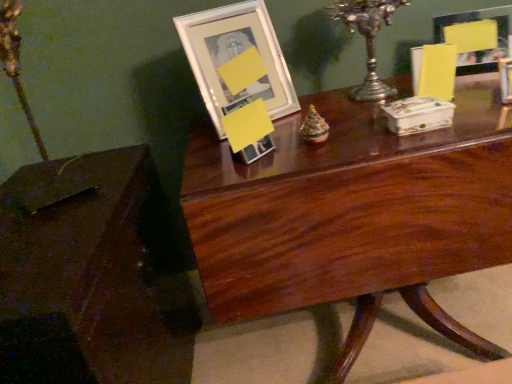
Describe the element at coordinates (92, 275) in the screenshot. I see `brown polished wood table at lower left, the 2th table viewed from the right` at that location.

The image size is (512, 384). Describe the element at coordinates (367, 39) in the screenshot. I see `silver metallic candle holder at upper center` at that location.

Where is `white glossy picture frame at upper center, placed as the 2th picture frame when sorted from right to left`? white glossy picture frame at upper center, placed as the 2th picture frame when sorted from right to left is located at coordinates (236, 56).

What do you see at coordinates (477, 50) in the screenshot?
I see `matte glass picture frame at upper right, acting as the 1th picture frame starting from the right` at bounding box center [477, 50].

How much space does matte glass picture frame at upper right, acting as the 1th picture frame starting from the right, occupy horizontally?

The width of matte glass picture frame at upper right, acting as the 1th picture frame starting from the right, is 4.42 inches.

This screenshot has width=512, height=384. Find the location of `brown polished wood table at lower left, the 1th table viewed from the left`. brown polished wood table at lower left, the 1th table viewed from the left is located at coordinates (92, 275).

From the image's perspective, relative to white glossy picture frame at upper center, the 1th picture frame positioned from the left, is matte glass picture frame at upper right, acting as the 1th picture frame starting from the right, above or below?

From the image's perspective, matte glass picture frame at upper right, acting as the 1th picture frame starting from the right, appears above white glossy picture frame at upper center, the 1th picture frame positioned from the left.

Consider the image. Is matte glass picture frame at upper right, acting as the 1th picture frame starting from the right, taller or shorter than white glossy picture frame at upper center, placed as the 2th picture frame when sorted from right to left?

Considering their sizes, matte glass picture frame at upper right, acting as the 1th picture frame starting from the right, has less height than white glossy picture frame at upper center, placed as the 2th picture frame when sorted from right to left.

From a real-world perspective, between matte glass picture frame at upper right, acting as the 1th picture frame starting from the right, and white glossy picture frame at upper center, the 1th picture frame positioned from the left, who is vertically lower?

matte glass picture frame at upper right, acting as the 1th picture frame starting from the right.

Which point is more distant from viewer, (193, 46) or (356, 267)?

The point (193, 46) is farther from the camera.

At what (x,y) coordinates should I click in order to perform the action: click on picture frame that is the 1st one when counting upward from the mahogany wood table at center, which is the second table in left-to-right order (from the image's perspective). Please return your answer as a coordinate pair (x, y). This screenshot has width=512, height=384. Looking at the image, I should click on (236, 56).

Is white glossy picture frame at upper center, placed as the 2th picture frame when sorted from right to left, looking in the opposite direction of mahogany wood table at center, acting as the first table starting from the right?

That's not correct — white glossy picture frame at upper center, placed as the 2th picture frame when sorted from right to left, is not looking away from mahogany wood table at center, acting as the first table starting from the right.

Can you confirm if silver metallic candle holder at upper center is smaller than white glossy picture frame at upper center, the 1th picture frame positioned from the left?

Yes.

Would you say silver metallic candle holder at upper center is a long distance from white glossy picture frame at upper center, the 1th picture frame positioned from the left?

silver metallic candle holder at upper center is near white glossy picture frame at upper center, the 1th picture frame positioned from the left, not far away.

Looking at this image, does silver metallic candle holder at upper center have a lesser height compared to white glossy picture frame at upper center, the 1th picture frame positioned from the left?

Yes.

Is there a large distance between silver metallic candle holder at upper center and matte glass picture frame at upper right, acting as the 1th picture frame starting from the right?

Actually, silver metallic candle holder at upper center and matte glass picture frame at upper right, acting as the 1th picture frame starting from the right, are a little close together.

From the picture: Is silver metallic candle holder at upper center positioned behind matte glass picture frame at upper right, acting as the 1th picture frame starting from the right?

No.

How different are the orientations of silver metallic candle holder at upper center and matte glass picture frame at upper right, acting as the 1th picture frame starting from the right, in degrees?

There is a 18.7-degree angle between the facing directions of silver metallic candle holder at upper center and matte glass picture frame at upper right, acting as the 1th picture frame starting from the right.

Which is closer to the camera, (372, 30) or (474, 65)?

Point (372, 30)

Based on the photo, from the image's perspective, is white glossy picture frame at upper center, the 1th picture frame positioned from the left, positioned above or below matte glass picture frame at upper right, which is counted as the 2th picture frame, starting from the left?

Clearly, from the image's perspective, white glossy picture frame at upper center, the 1th picture frame positioned from the left, is below matte glass picture frame at upper right, which is counted as the 2th picture frame, starting from the left.

From the picture: Does white glossy picture frame at upper center, placed as the 2th picture frame when sorted from right to left, appear on the right side of matte glass picture frame at upper right, acting as the 1th picture frame starting from the right?

Incorrect, white glossy picture frame at upper center, placed as the 2th picture frame when sorted from right to left, is not on the right side of matte glass picture frame at upper right, acting as the 1th picture frame starting from the right.

Is white glossy picture frame at upper center, placed as the 2th picture frame when sorted from right to left, far away from matte glass picture frame at upper right, which is counted as the 2th picture frame, starting from the left?

white glossy picture frame at upper center, placed as the 2th picture frame when sorted from right to left, is actually quite close to matte glass picture frame at upper right, which is counted as the 2th picture frame, starting from the left.

Considering the relative sizes of white glossy picture frame at upper center, placed as the 2th picture frame when sorted from right to left, and matte glass picture frame at upper right, acting as the 1th picture frame starting from the right, in the image provided, is white glossy picture frame at upper center, placed as the 2th picture frame when sorted from right to left, bigger than matte glass picture frame at upper right, acting as the 1th picture frame starting from the right,?

Correct, white glossy picture frame at upper center, placed as the 2th picture frame when sorted from right to left, is larger in size than matte glass picture frame at upper right, acting as the 1th picture frame starting from the right.

Considering the positions of objects brown polished wood table at lower left, the 2th table viewed from the right, and silver metallic candle holder at upper center in the image provided, who is more to the left, brown polished wood table at lower left, the 2th table viewed from the right, or silver metallic candle holder at upper center?

brown polished wood table at lower left, the 2th table viewed from the right.

Is brown polished wood table at lower left, the 2th table viewed from the right, facing away from silver metallic candle holder at upper center?

No, silver metallic candle holder at upper center is not at the back of brown polished wood table at lower left, the 2th table viewed from the right.

Considering the relative positions of brown polished wood table at lower left, the 1th table viewed from the left, and silver metallic candle holder at upper center in the image provided, is brown polished wood table at lower left, the 1th table viewed from the left, behind silver metallic candle holder at upper center?

No, it is not.

The image size is (512, 384). In order to click on candle holder above the brown polished wood table at lower left, the 2th table viewed from the right (from a real-world perspective) in this screenshot , I will do `click(367, 39)`.

Is mahogany wood table at center, which is the second table in left-to-right order, spatially inside brown polished wood table at lower left, the 1th table viewed from the left, or outside of it?

The correct answer is: outside.

Is the position of mahogany wood table at center, acting as the first table starting from the right, less distant than that of brown polished wood table at lower left, the 1th table viewed from the left?

No, the depth of mahogany wood table at center, acting as the first table starting from the right, is greater than that of brown polished wood table at lower left, the 1th table viewed from the left.

The height and width of the screenshot is (384, 512). I want to click on table located underneath the mahogany wood table at center, which is the second table in left-to-right order (from a real-world perspective), so click(x=92, y=275).

Locate an element on the screen. picture frame in front of the matte glass picture frame at upper right, acting as the 1th picture frame starting from the right is located at coordinates (236, 56).

Starting from the mahogany wood table at center, acting as the first table starting from the right, which picture frame is the 1st one behind? Please provide its 2D coordinates.

[(236, 56)]

When comparing their distances from mahogany wood table at center, which is the second table in left-to-right order, does white glossy picture frame at upper center, the 1th picture frame positioned from the left, or brown polished wood table at lower left, the 2th table viewed from the right, seem closer?

white glossy picture frame at upper center, the 1th picture frame positioned from the left.

Which object lies further to the anchor point matte glass picture frame at upper right, which is counted as the 2th picture frame, starting from the left, brown polished wood table at lower left, the 1th table viewed from the left, or mahogany wood table at center, acting as the first table starting from the right?

brown polished wood table at lower left, the 1th table viewed from the left, is further to matte glass picture frame at upper right, which is counted as the 2th picture frame, starting from the left.

Based on their spatial positions, is white glossy picture frame at upper center, the 1th picture frame positioned from the left, or silver metallic candle holder at upper center closer to brown polished wood table at lower left, the 2th table viewed from the right?

white glossy picture frame at upper center, the 1th picture frame positioned from the left, lies closer to brown polished wood table at lower left, the 2th table viewed from the right, than the other object.

In the scene shown: Which object lies nearer to the anchor point silver metallic candle holder at upper center, matte glass picture frame at upper right, acting as the 1th picture frame starting from the right, or mahogany wood table at center, which is the second table in left-to-right order?

matte glass picture frame at upper right, acting as the 1th picture frame starting from the right.

Looking at this image, from the image, which object appears to be nearer to white glossy picture frame at upper center, the 1th picture frame positioned from the left, silver metallic candle holder at upper center or brown polished wood table at lower left, the 1th table viewed from the left?

silver metallic candle holder at upper center.

Based on their spatial positions, is white glossy picture frame at upper center, placed as the 2th picture frame when sorted from right to left, or matte glass picture frame at upper right, which is counted as the 2th picture frame, starting from the left, further from silver metallic candle holder at upper center?

white glossy picture frame at upper center, placed as the 2th picture frame when sorted from right to left, is positioned further to the anchor silver metallic candle holder at upper center.

When comparing their distances from mahogany wood table at center, acting as the first table starting from the right, does silver metallic candle holder at upper center or brown polished wood table at lower left, the 1th table viewed from the left, seem further?

brown polished wood table at lower left, the 1th table viewed from the left, is further to mahogany wood table at center, acting as the first table starting from the right.

Estimate the real-world distances between objects in this image. Which object is closer to brown polished wood table at lower left, the 1th table viewed from the left, matte glass picture frame at upper right, acting as the 1th picture frame starting from the right, or white glossy picture frame at upper center, the 1th picture frame positioned from the left?

white glossy picture frame at upper center, the 1th picture frame positioned from the left, lies closer to brown polished wood table at lower left, the 1th table viewed from the left, than the other object.

You are a GUI agent. You are given a task and a screenshot of the screen. Output one action in this format:
    pyautogui.click(x=<x>, y=<y>)
    Task: Click on the table between white glossy picture frame at upper center, the 1th picture frame positioned from the left, and matte glass picture frame at upper right, which is counted as the 2th picture frame, starting from the left
    This screenshot has width=512, height=384.
    Given the screenshot: What is the action you would take?
    pyautogui.click(x=353, y=214)

Identify the location of candle holder between matte glass picture frame at upper right, acting as the 1th picture frame starting from the right, and mahogany wood table at center, acting as the first table starting from the right, vertically. This screenshot has width=512, height=384. (367, 39).

Identify the location of picture frame between silver metallic candle holder at upper center and brown polished wood table at lower left, the 1th table viewed from the left, in the up-down direction. (236, 56).

The height and width of the screenshot is (384, 512). Find the location of `candle holder between brown polished wood table at lower left, the 1th table viewed from the left, and matte glass picture frame at upper right, which is counted as the 2th picture frame, starting from the left`. candle holder between brown polished wood table at lower left, the 1th table viewed from the left, and matte glass picture frame at upper right, which is counted as the 2th picture frame, starting from the left is located at coordinates coord(367,39).